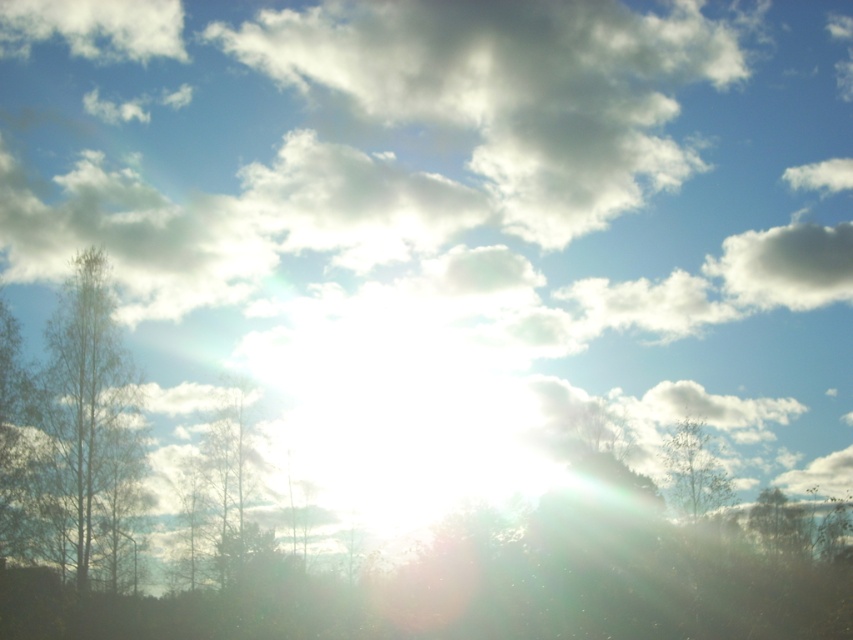
You are a bird looking for a place to perch. You see the green matte tree at left and the green leafy tree at right. Which tree is located below the other?

The green matte tree at left is positioned under the green leafy tree at right.

You are standing in the center of the scene and want to take a photo of the green matte tree at left. Which direction should you face to capture it in your camera view?

The green matte tree at left is located at point 0.767 on the x axis and 0.257 on the y axis. Since the coordinates are relative to the image frame, facing towards the left side of the scene would allow you to capture the green matte tree at left in your camera view.